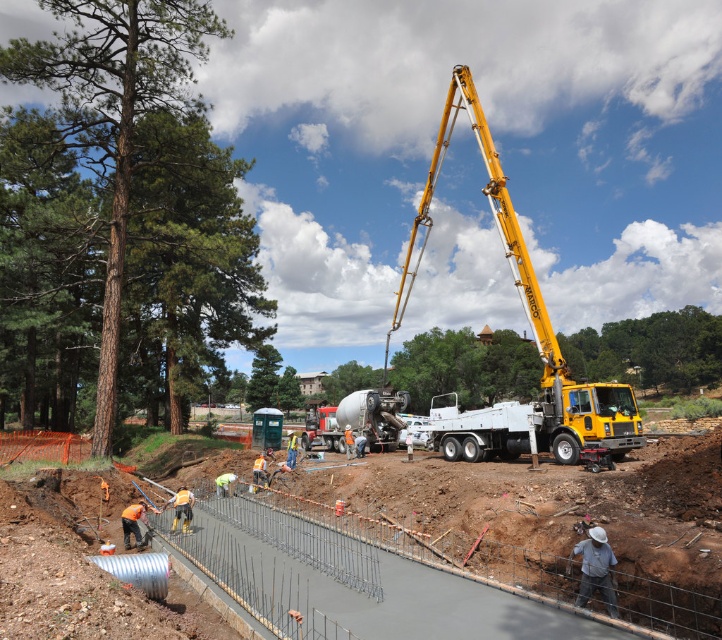
Find the location of a particular element. This screenshot has width=722, height=640. white metallic truck at center is located at coordinates (539, 422).

Who is positioned more to the left, white metallic truck at center or matte concrete mixer at center?

From the viewer's perspective, matte concrete mixer at center appears more on the left side.

Measure the distance between point (490, 429) and camera.

Point (490, 429) and camera are 18.78 meters apart from each other.

This screenshot has height=640, width=722. I want to click on white metallic truck at center, so coord(539,422).

Is point (422, 243) more distant than point (355, 420)?

Yes, it is.

This screenshot has width=722, height=640. Find the location of `yellow metallic crane at center`. yellow metallic crane at center is located at coordinates (526, 301).

Between yellow metallic crane at center and white metallic truck at center, which one is positioned higher?

yellow metallic crane at center

Does yellow metallic crane at center have a lesser height compared to white metallic truck at center?

No.

I want to click on yellow metallic crane at center, so click(526, 301).

Where is `yellow metallic crane at center`? yellow metallic crane at center is located at coordinates (526, 301).